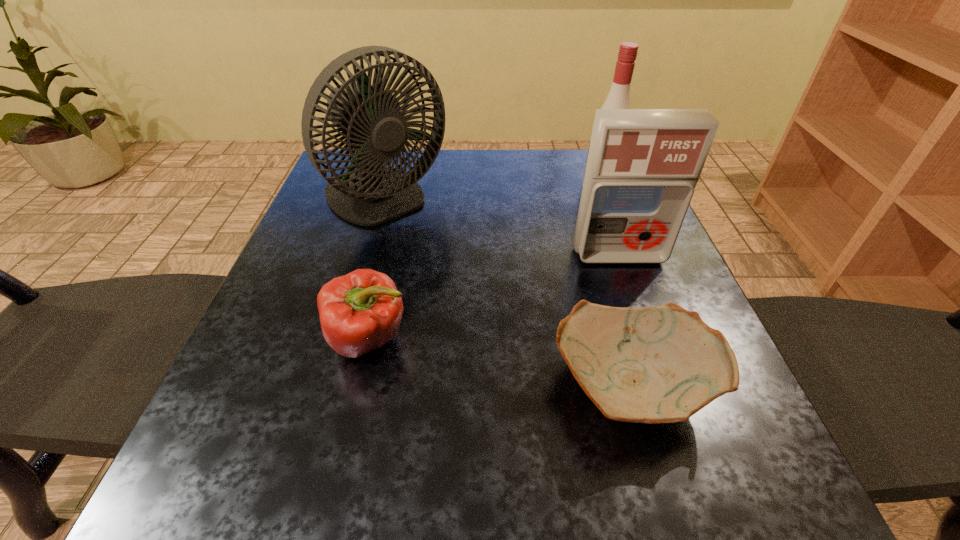
Where is `object that is at the far right corner`? object that is at the far right corner is located at coordinates (618, 97).

In the image, there is a desktop. At what (x,y) coordinates should I click in order to perform the action: click on vacant space at the far edge. Please return your answer as a coordinate pair (x, y). The width and height of the screenshot is (960, 540). Looking at the image, I should click on (426, 183).

Where is `blank space at the near edge of the desktop`? The image size is (960, 540). blank space at the near edge of the desktop is located at coordinates (608, 491).

Where is `vacant space at the left edge of the desktop`? This screenshot has height=540, width=960. vacant space at the left edge of the desktop is located at coordinates (252, 406).

In the image, there is a desktop. Identify the location of vacant space at the right edge. The image size is (960, 540). (642, 302).

Locate an element on the screen. The image size is (960, 540). free region at the far right corner of the desktop is located at coordinates (573, 159).

Find the location of `free space between the pottery and the fan`. free space between the pottery and the fan is located at coordinates (508, 294).

Identify the location of empty location between the fan and the shortest object. (508, 294).

Locate an element on the screen. free space between the second shortest object and the pottery is located at coordinates (500, 362).

Where is `free space between the fan and the shortest object`? This screenshot has width=960, height=540. free space between the fan and the shortest object is located at coordinates (508, 294).